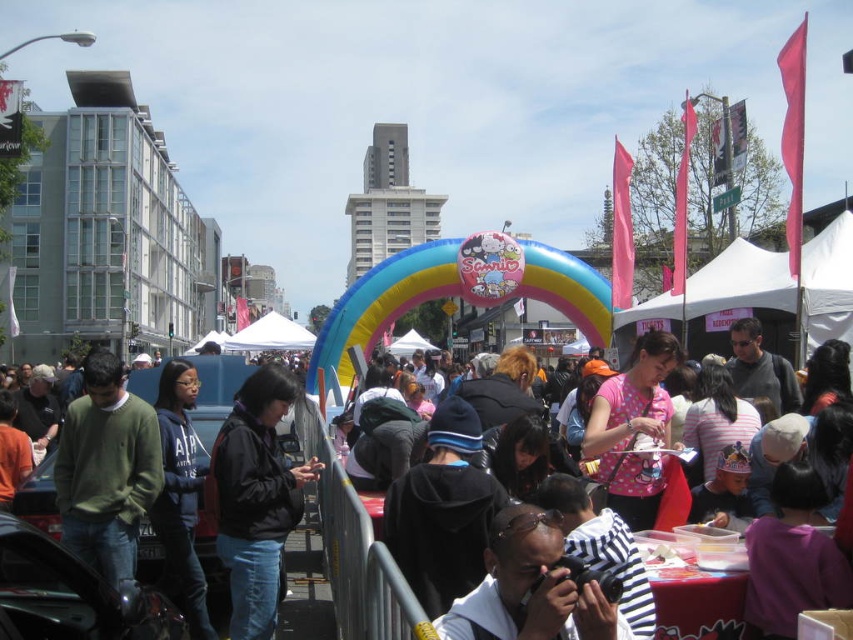
Measure the distance between matte black jacket at center and black matte jacket at center.

matte black jacket at center is 16.66 feet away from black matte jacket at center.

Is point (305, 429) less distant than point (286, 493)?

No, it is not.

This screenshot has width=853, height=640. What are the coordinates of `matte black jacket at center` in the screenshot? It's located at (346, 545).